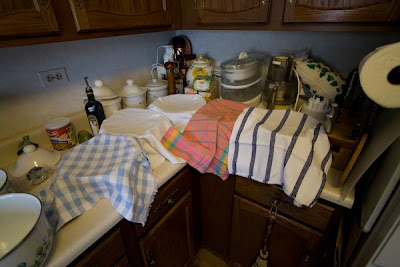
Find the location of a particular element. This screenshot has width=400, height=267. countertop is located at coordinates (97, 218).